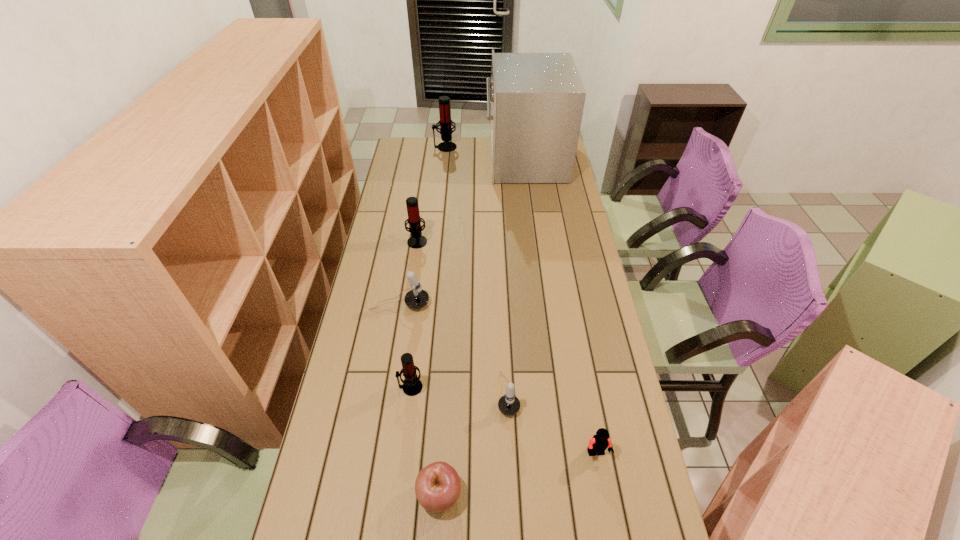
The image size is (960, 540). What are the coordinates of `free spot between the nearest object and the sixth nearest object` in the screenshot? It's located at (428, 367).

This screenshot has height=540, width=960. What are the coordinates of `free space between the Lego and the third tallest object` in the screenshot? It's located at (507, 347).

You are a GUI agent. You are given a task and a screenshot of the screen. Output one action in this format:
    pyautogui.click(x=<x>, y=<y>)
    Task: Click on the object that is the third closest one to the right white microphone
    
    Given the screenshot: What is the action you would take?
    pyautogui.click(x=412, y=385)

Locate an element on the screen. The width and height of the screenshot is (960, 540). object that stands as the seventh closest to the farthest microphone is located at coordinates tap(437, 487).

Where is `microphone that stands as the third closest to the second biggest red microphone`? The width and height of the screenshot is (960, 540). microphone that stands as the third closest to the second biggest red microphone is located at coordinates (509, 405).

In order to click on microphone object that ranks as the third closest to the second biggest red microphone in this screenshot , I will do [x=509, y=405].

Find the location of a particular element. the closest red microphone to the nearer white microphone is located at coordinates (412, 385).

The image size is (960, 540). In order to click on red microphone that is the closest one to the sixth shortest object in this screenshot , I will do `click(412, 385)`.